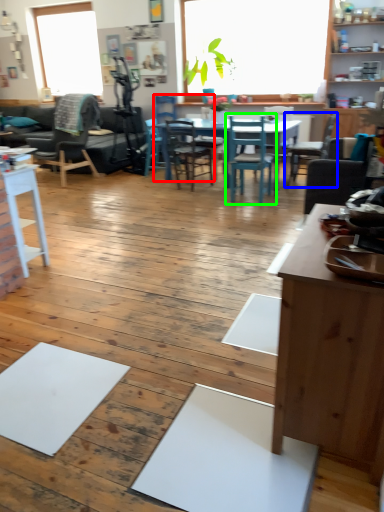
Question: Which is farther away from chair (highlighted by a red box)? chair (highlighted by a blue box) or chair (highlighted by a green box)?

Choices:
 (A) chair
 (B) chair

Answer: (A)